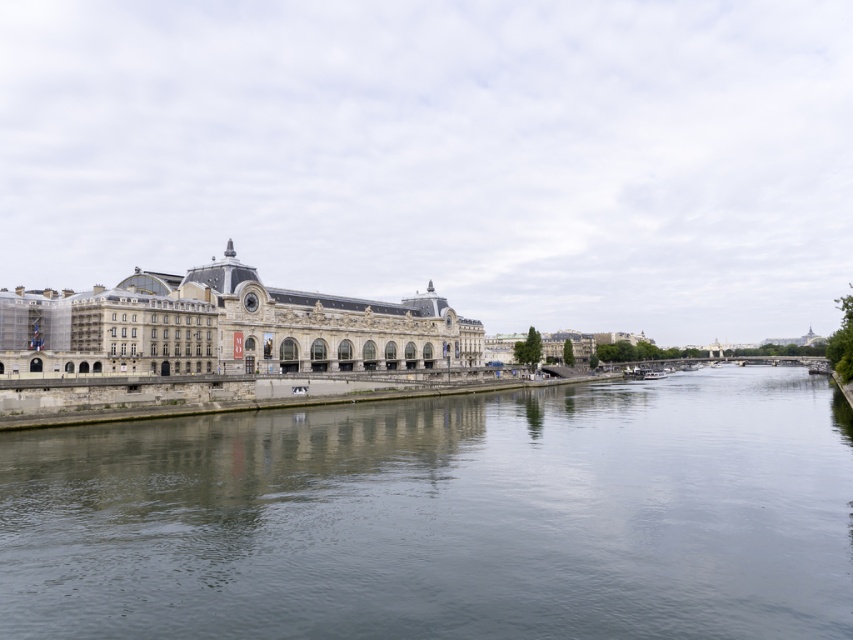
Question: Can you confirm if smooth gray water at center is smaller than stone building at center?

Choices:
 (A) yes
 (B) no

Answer: (A)

Question: Is smooth gray water at center wider than stone building at center?

Choices:
 (A) yes
 (B) no

Answer: (A)

Question: Can you confirm if smooth gray water at center is smaller than stone building at center?

Choices:
 (A) no
 (B) yes

Answer: (B)

Question: Which object appears closest to the camera in this image?

Choices:
 (A) smooth gray water at center
 (B) stone building at center

Answer: (A)